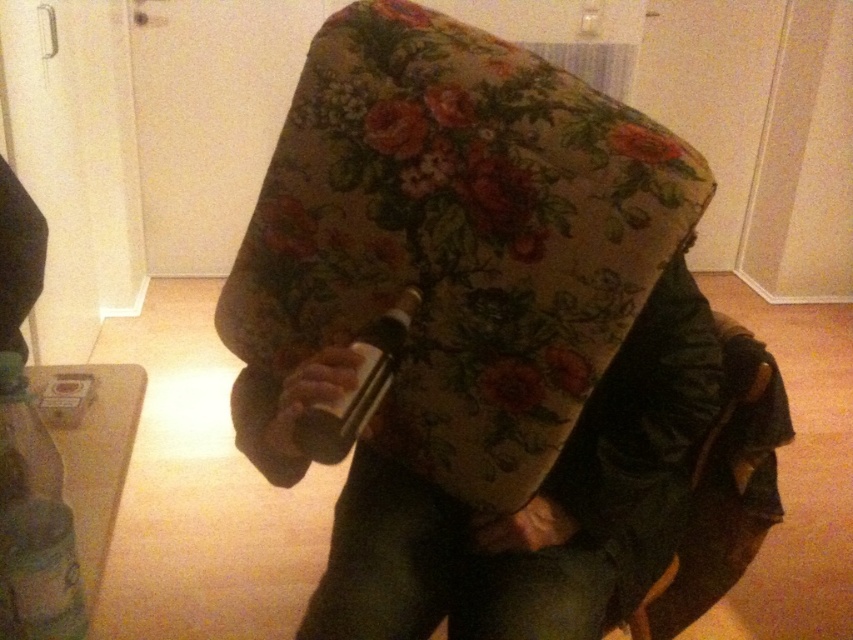
From the picture: Based on the scene description, where is the floral fabric armchair at center located in terms of coordinates?

The floral fabric armchair at center is located at coordinates point (497, 342).

You are organizing a small party and need to place a decorative bottle on the table. You have a translucent plastic bottle at lower left and a floral fabric armchair at center. Which object should you place the bottle on to ensure it is on the left side of the room?

You should place the translucent plastic bottle at lower left on the table because it is already positioned at the lower left, making it naturally on the left side of the room.